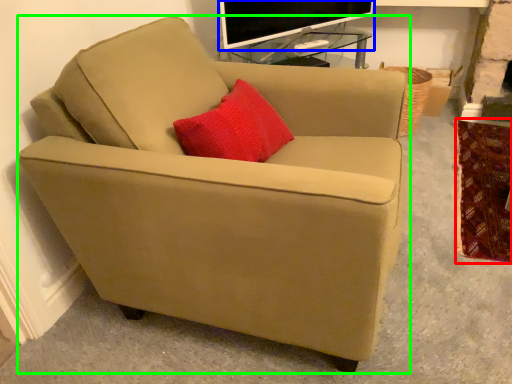
Question: Which is farther away from blanket (highlighted by a red box)? television (highlighted by a blue box) or chair (highlighted by a green box)?

Choices:
 (A) television
 (B) chair

Answer: (A)